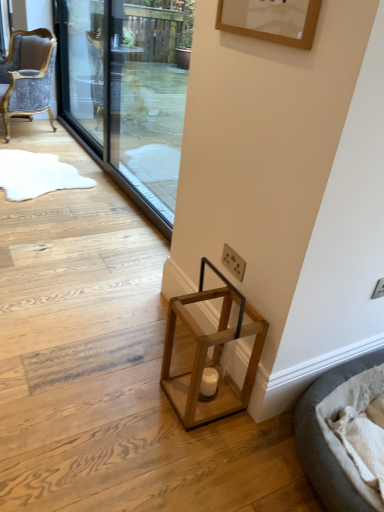
Question: From a real-world perspective, is transparent glass screen door at upper center, positioned as the first screen door in right-to-left order, located higher than soft gray fabric cat bed at lower right?

Choices:
 (A) no
 (B) yes

Answer: (B)

Question: Is transparent glass screen door at upper center, positioned as the first screen door in right-to-left order, smaller than soft gray fabric cat bed at lower right?

Choices:
 (A) no
 (B) yes

Answer: (A)

Question: Considering the relative sizes of transparent glass screen door at upper center, which is counted as the 2th screen door, starting from the left, and soft gray fabric cat bed at lower right in the image provided, is transparent glass screen door at upper center, which is counted as the 2th screen door, starting from the left, bigger than soft gray fabric cat bed at lower right?

Choices:
 (A) yes
 (B) no

Answer: (A)

Question: Is transparent glass screen door at upper center, which is counted as the 2th screen door, starting from the left, taller than soft gray fabric cat bed at lower right?

Choices:
 (A) yes
 (B) no

Answer: (A)

Question: Does transparent glass screen door at upper center, positioned as the first screen door in right-to-left order, have a lesser width compared to soft gray fabric cat bed at lower right?

Choices:
 (A) yes
 (B) no

Answer: (A)

Question: In terms of width, does transparent glass screen door at upper center, which is counted as the 2th screen door, starting from the left, look wider or thinner when compared to transparent glass screen door at upper left, which is the second screen door from right to left?

Choices:
 (A) wide
 (B) thin

Answer: (A)

Question: From a real-world perspective, is transparent glass screen door at upper center, positioned as the first screen door in right-to-left order, above or below transparent glass screen door at upper left, which is the second screen door from right to left?

Choices:
 (A) below
 (B) above

Answer: (B)

Question: Does point (175, 74) appear closer or farther from the camera than point (94, 20)?

Choices:
 (A) closer
 (B) farther

Answer: (B)

Question: Considering the positions of transparent glass screen door at upper center, which is counted as the 2th screen door, starting from the left, and transparent glass screen door at upper left, which is the second screen door from right to left, in the image, is transparent glass screen door at upper center, which is counted as the 2th screen door, starting from the left, taller or shorter than transparent glass screen door at upper left, which is the second screen door from right to left,?

Choices:
 (A) tall
 (B) short

Answer: (A)

Question: Considering their positions, is wooden lantern at lower center located in front of or behind transparent glass screen door at upper center, which is counted as the 2th screen door, starting from the left?

Choices:
 (A) behind
 (B) front

Answer: (B)

Question: Looking at their shapes, would you say wooden lantern at lower center is wider or thinner than transparent glass screen door at upper center, positioned as the first screen door in right-to-left order?

Choices:
 (A) thin
 (B) wide

Answer: (A)

Question: Is wooden lantern at lower center situated inside transparent glass screen door at upper center, positioned as the first screen door in right-to-left order, or outside?

Choices:
 (A) inside
 (B) outside

Answer: (B)

Question: In the image, is wooden lantern at lower center on the left side or the right side of transparent glass screen door at upper center, positioned as the first screen door in right-to-left order?

Choices:
 (A) right
 (B) left

Answer: (A)

Question: From their relative heights in the image, would you say transparent glass screen door at upper center, positioned as the first screen door in right-to-left order, is taller or shorter than wooden lantern at lower center?

Choices:
 (A) tall
 (B) short

Answer: (A)

Question: Is transparent glass screen door at upper center, which is counted as the 2th screen door, starting from the left, bigger or smaller than wooden lantern at lower center?

Choices:
 (A) small
 (B) big

Answer: (B)